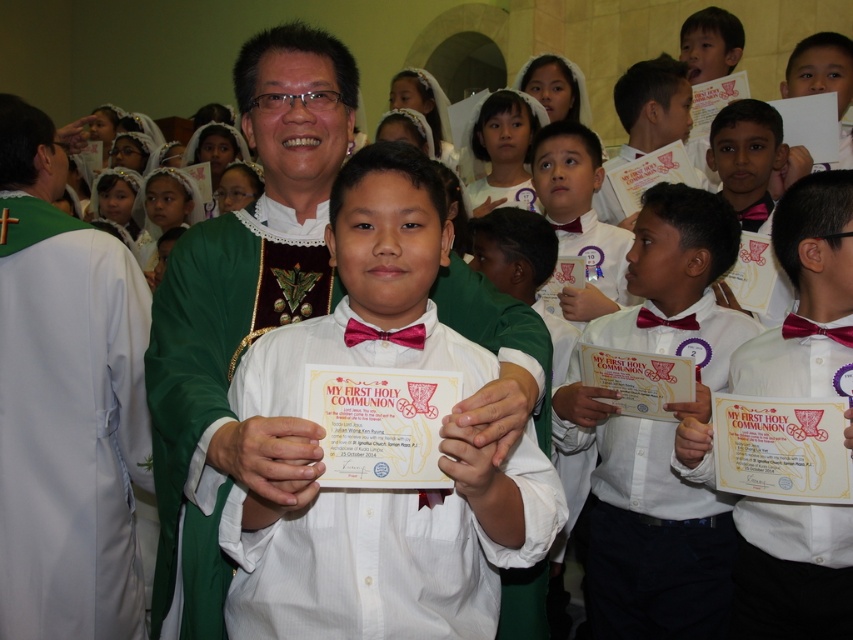
Between white glossy shirt at center and white paper certificate at center, which one has more height?

white paper certificate at center is taller.

Does white glossy shirt at center appear on the left side of white paper certificate at center?

Correct, you'll find white glossy shirt at center to the left of white paper certificate at center.

This screenshot has height=640, width=853. I want to click on white glossy shirt at center, so click(392, 552).

Is white glossy shirt at center behind white satin bow tie at center?

No, it is in front of white satin bow tie at center.

Is point (525, 483) less distant than point (596, 508)?

Yes, point (525, 483) is in front of point (596, 508).

At what (x,y) coordinates should I click in order to perform the action: click on white glossy shirt at center. Please return your answer as a coordinate pair (x, y). Looking at the image, I should click on (392, 552).

Is point (663, 305) more distant than point (792, 317)?

Yes, point (663, 305) is farther from viewer.

Between white satin bow tie at center and white glossy bow tie at center, which one appears on the right side from the viewer's perspective?

white glossy bow tie at center

Which is behind, point (728, 512) or point (828, 346)?

Positioned behind is point (728, 512).

At what (x,y) coordinates should I click in order to perform the action: click on white satin bow tie at center. Please return your answer as a coordinate pair (x, y). The height and width of the screenshot is (640, 853). Looking at the image, I should click on (646, 528).